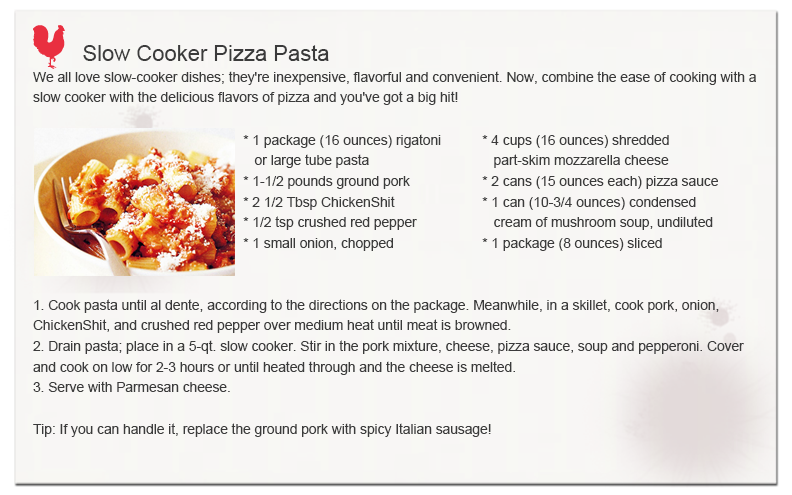
Locate an element on the screen. white bowl is located at coordinates (136, 142).